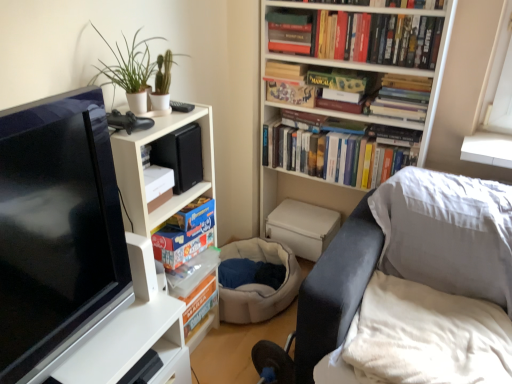
Question: From a real-world perspective, is green matte plant at upper left positioned above or below matte black tv at left?

Choices:
 (A) above
 (B) below

Answer: (A)

Question: Visually, is green matte plant at upper left positioned to the left or to the right of matte black tv at left?

Choices:
 (A) right
 (B) left

Answer: (A)

Question: Considering the real-world distances, which object is farthest from the matte board game at center, the sixth book viewed from the top?

Choices:
 (A) white glossy table at left
 (B) hardcover books at upper center, which is counted as the 4th book, starting from the top
 (C) matt black board game at upper center, which is the third book in top-to-bottom order
 (D) white matte bookcase at upper left, which ranks as the second bookcase in right-to-left order
 (E) matte black tv at left

Answer: (B)

Question: Considering the real-world distances, which object is closest to the hardcover books at upper center, marked as the 2th book in a bottom-to-top arrangement?

Choices:
 (A) matt black board game at upper center, the 4th book from the bottom
 (B) hardcover book at upper center, which is counted as the 2th book, starting from the top
 (C) dark gray leather swivel chair at lower right
 (D) hardcover book at upper center, which appears as the 1th book when viewed from the top
 (E) white glossy table at left

Answer: (A)